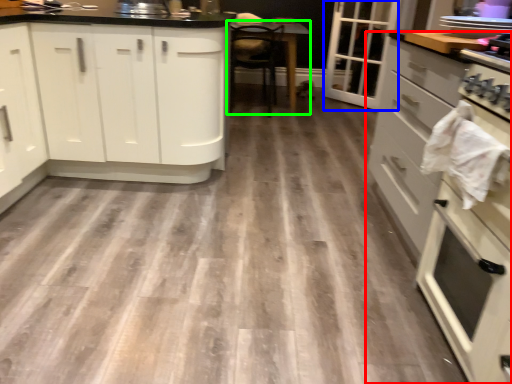
Question: Which is farther away from cabinetry (highlighted by a red box)? glass door (highlighted by a blue box) or table (highlighted by a green box)?

Choices:
 (A) glass door
 (B) table

Answer: (A)